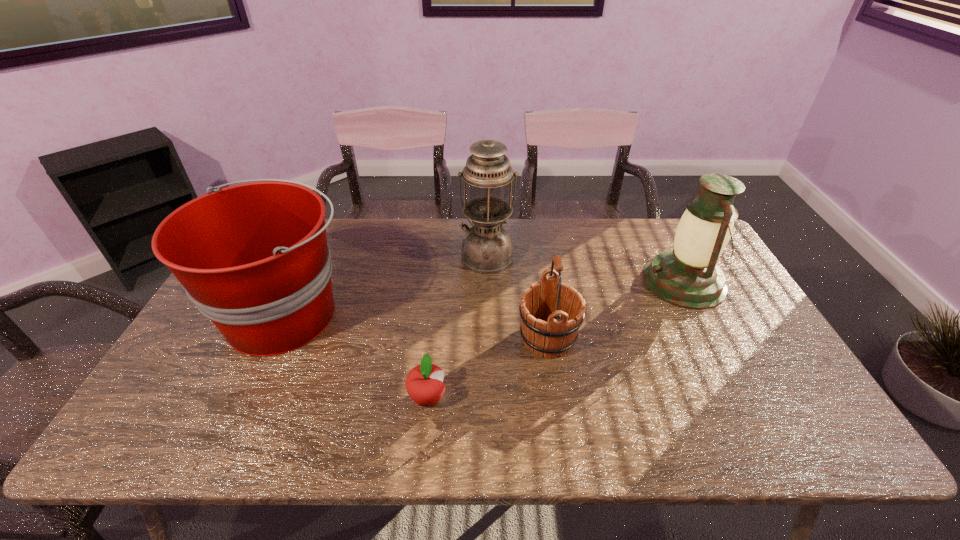
At what (x,y) coordinates should I click in order to perform the action: click on vacant area that lies between the rightmost object and the oil lamp. Please return your answer as a coordinate pair (x, y). Image resolution: width=960 pixels, height=540 pixels. Looking at the image, I should click on (586, 269).

At what (x,y) coordinates should I click in order to perform the action: click on free spot between the lantern and the leftmost object. Please return your answer as a coordinate pair (x, y). This screenshot has height=540, width=960. Looking at the image, I should click on (485, 298).

Find the location of a particular element. This screenshot has height=540, width=960. vacant space in between the fourth tallest object and the oil lamp is located at coordinates (517, 297).

Identify the location of object identified as the second closest to the lantern. This screenshot has height=540, width=960. (487, 248).

Identify which object is the closest to the shortest object. Please provide its 2D coordinates. Your answer should be formatted as a tuple, i.e. [(x, y)], where the tuple contains the x and y coordinates of a point satisfying the conditions above.

[(551, 312)]

Find the location of a particular element. The width and height of the screenshot is (960, 540). free spot that satisfies the following two spatial constraints: 1. on the back side of the second object from left to right; 2. on the left side of the oil lamp is located at coordinates (443, 256).